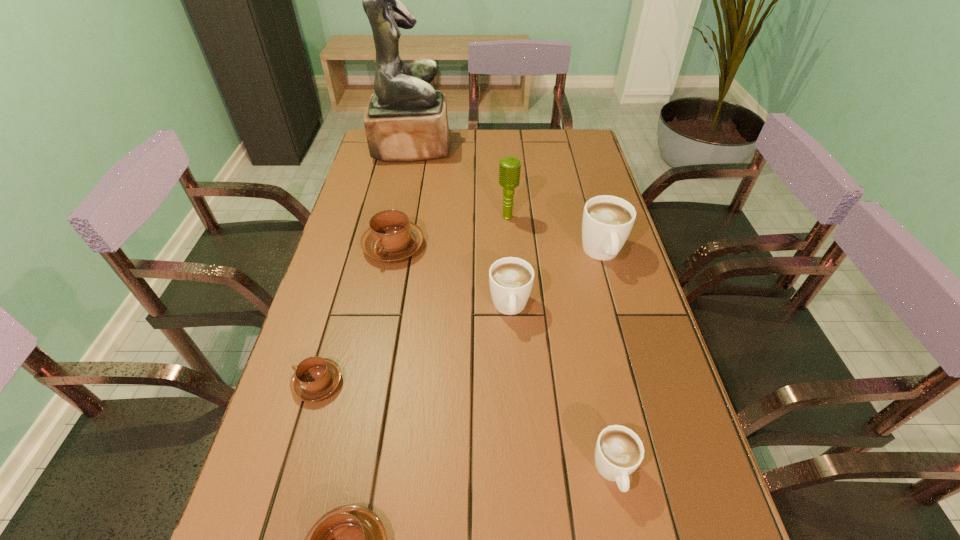
Identify the location of vacant area that lies between the second farthest brown cappuccino and the farthest white cappuccino. (460, 318).

Locate an element on the screen. free spot between the biggest brown cappuccino and the second nearest cappuccino is located at coordinates (503, 359).

The width and height of the screenshot is (960, 540). In order to click on blank region between the shortest object and the seventh shortest object in this screenshot , I will do `click(413, 300)`.

Where is `object identified as the second closest to the second biggest brown cappuccino`? object identified as the second closest to the second biggest brown cappuccino is located at coordinates tap(619, 451).

This screenshot has width=960, height=540. Identify the location of the third closest object to the tallest object. (607, 221).

Identify which cappuccino is located as the third nearest to the biggest brown cappuccino. Please provide its 2D coordinates. Your answer should be formatted as a tuple, i.e. [(x, y)], where the tuple contains the x and y coordinates of a point satisfying the conditions above.

[(607, 221)]

Where is `the second closest cappuccino to the tallest object`? the second closest cappuccino to the tallest object is located at coordinates (607, 221).

The height and width of the screenshot is (540, 960). Find the location of `the closest white cappuccino to the seventh nearest object`. the closest white cappuccino to the seventh nearest object is located at coordinates (607, 221).

I want to click on white cappuccino identified as the closest to the tallest object, so click(607, 221).

Locate which brown cappuccino is the closest to the farthest brown cappuccino. Please provide its 2D coordinates. Your answer should be formatted as a tuple, i.e. [(x, y)], where the tuple contains the x and y coordinates of a point satisfying the conditions above.

[(315, 378)]